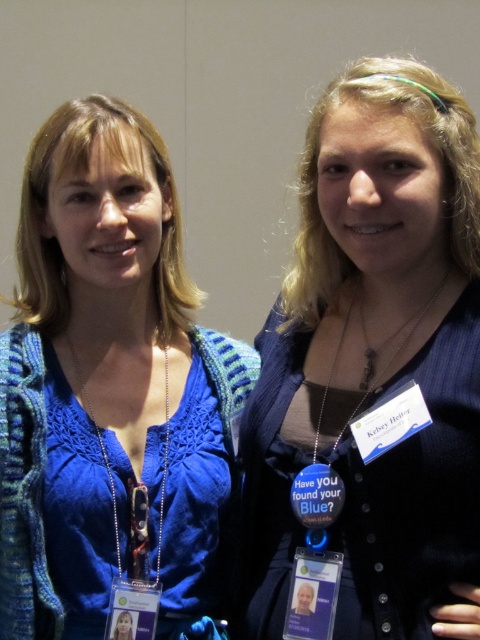
Question: Which object is farther from the camera taking this photo?

Choices:
 (A) matte blue sweater at center
 (B) blue fabric lanyard at center
 (C) silver metallic chain at center
 (D) blue fabric shirt at center

Answer: (C)

Question: Is blue fabric shirt at center thinner than silver metallic chain at center?

Choices:
 (A) yes
 (B) no

Answer: (B)

Question: Which of the following is the farthest from the observer?

Choices:
 (A) (10, 598)
 (B) (424, 182)

Answer: (A)

Question: Which of the following is the closest to the observer?

Choices:
 (A) matte blue sweater at center
 (B) blue fabric lanyard at center
 (C) silver metallic chain at center

Answer: (B)

Question: Does blue fabric shirt at center appear on the right side of silver metallic chain at center?

Choices:
 (A) no
 (B) yes

Answer: (B)

Question: Can you confirm if silver metallic chain at center is wider than blue fabric lanyard at center?

Choices:
 (A) no
 (B) yes

Answer: (A)